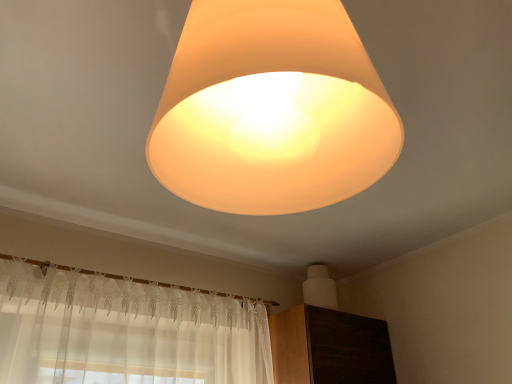
Question: Is point (173, 185) positioned closer to the camera than point (336, 331)?

Choices:
 (A) closer
 (B) farther

Answer: (A)

Question: Is matte orange lampshade at upper center taller or shorter than dark wood dresser at lower right?

Choices:
 (A) short
 (B) tall

Answer: (B)

Question: In terms of width, does matte orange lampshade at upper center look wider or thinner when compared to dark wood dresser at lower right?

Choices:
 (A) thin
 (B) wide

Answer: (A)

Question: Visually, is dark wood dresser at lower right positioned to the left or to the right of matte orange lampshade at upper center?

Choices:
 (A) left
 (B) right

Answer: (B)

Question: From the image's perspective, is dark wood dresser at lower right located above or below matte orange lampshade at upper center?

Choices:
 (A) above
 (B) below

Answer: (B)

Question: In the image, is dark wood dresser at lower right positioned in front of or behind matte orange lampshade at upper center?

Choices:
 (A) behind
 (B) front

Answer: (A)

Question: Is dark wood dresser at lower right taller or shorter than matte orange lampshade at upper center?

Choices:
 (A) short
 (B) tall

Answer: (A)